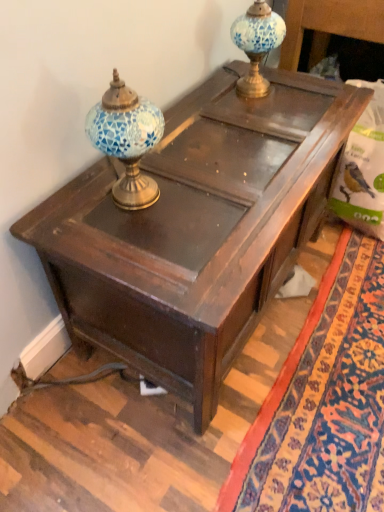
Locate an element on the screen. vacant region in front of wooden table at center is located at coordinates (225, 434).